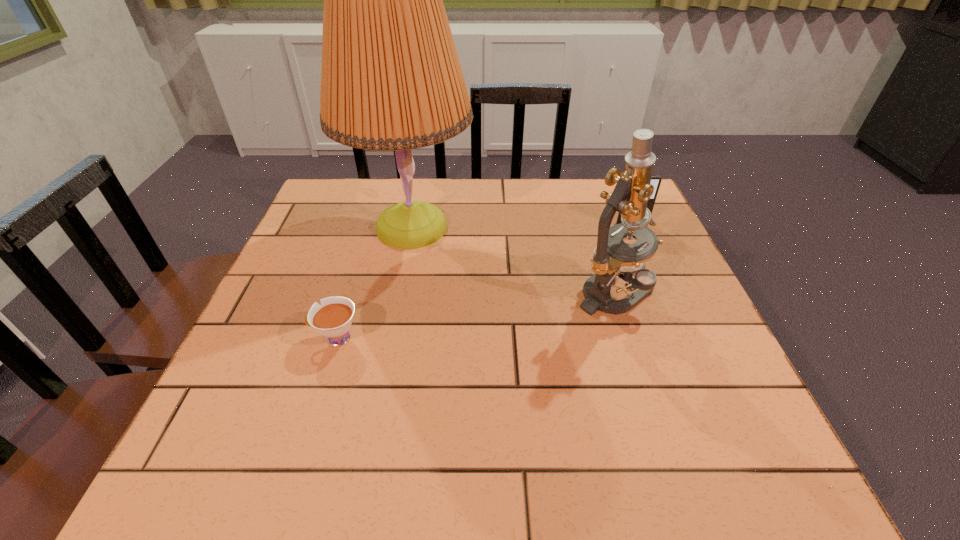
Find the location of a particular element. Image resolution: width=960 pixels, height=540 pixels. free spot between the teacup and the iPod is located at coordinates (484, 281).

The width and height of the screenshot is (960, 540). In order to click on free spot between the tallest object and the second tallest object in this screenshot , I will do `click(513, 260)`.

Where is `empty space between the tallest object and the microscope`? Image resolution: width=960 pixels, height=540 pixels. empty space between the tallest object and the microscope is located at coordinates (513, 260).

Select which object is the second closest to the second shortest object. Please provide its 2D coordinates. Your answer should be formatted as a tuple, i.e. [(x, y)], where the tuple contains the x and y coordinates of a point satisfying the conditions above.

[(391, 80)]

Locate an element on the screen. The width and height of the screenshot is (960, 540). object that is the second nearest to the tallest object is located at coordinates (612, 256).

Identify the location of free location that satisfies the following two spatial constraints: 1. on the front-facing side of the iPod; 2. on the side of the teacup with the handle. (682, 338).

Locate an element on the screen. Image resolution: width=960 pixels, height=540 pixels. free location that satisfies the following two spatial constraints: 1. on the front-facing side of the iPod; 2. on the side of the lamp near the pull switch is located at coordinates (633, 228).

Identify the location of free location that satisfies the following two spatial constraints: 1. on the front-facing side of the second shortest object; 2. on the side of the lamp near the pull switch. (633, 228).

The image size is (960, 540). Identify the location of vacant space that satisfies the following two spatial constraints: 1. on the front side of the third shortest object; 2. on the side of the shortest object with the handle. (x=628, y=338).

This screenshot has width=960, height=540. I want to click on free location that satisfies the following two spatial constraints: 1. on the front-facing side of the third tallest object; 2. on the side of the nearest object with the handle, so click(x=682, y=338).